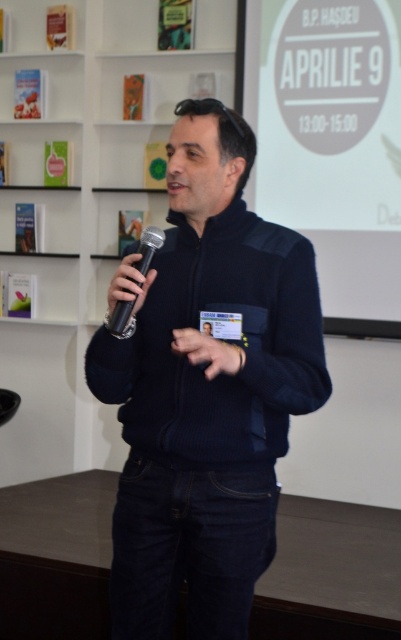
You are standing in the same room as the man and want to determine which of the two points, point (157, 72) or point (396, 198), is closer to you. Based on the image, which point is nearer?

Point (157, 72) is further to the viewer than point (396, 198). Wait, no, the description says the first point is further to the viewer than the second. So the second point is closer. Hmm, need to clarify. The answer should state that point (157, 72) is further away, so the closer one is point (396, 198).

What is the exact coordinate of the dark blue sweater at center?

The dark blue sweater at center is located at point [206,388].

You are a photographer setting up for an event. You need to ensure that the dark blue sweater at center and the black matte microphone at left are both visible in your shot. Based on their sizes, which object would require more horizontal space in the frame?

The dark blue sweater at center might be wider than the black matte microphone at left, so it would require more horizontal space in the frame.